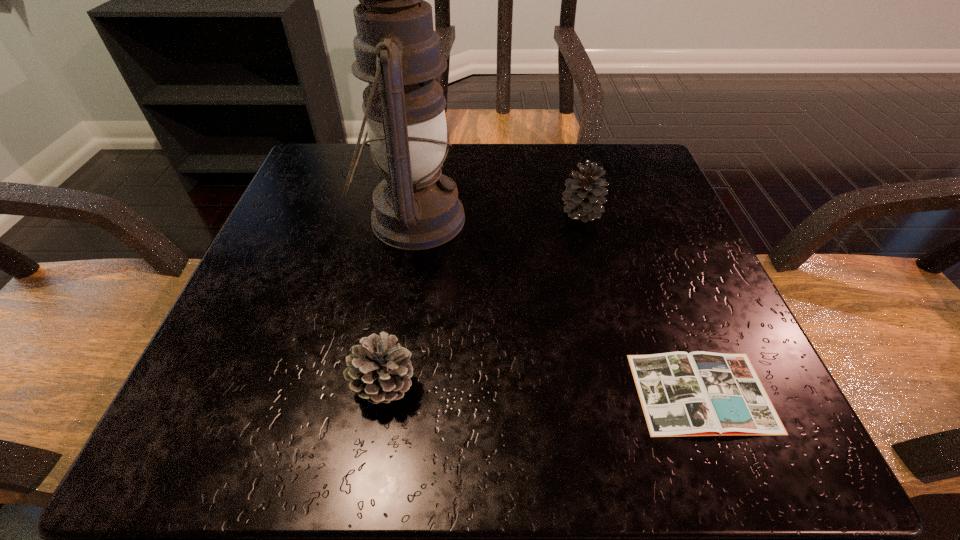
The width and height of the screenshot is (960, 540). In the image, there is a desktop. In order to click on vacant space at the far edge in this screenshot , I will do `click(505, 144)`.

Find the location of `free space at the near edge`. free space at the near edge is located at coordinates (402, 424).

Where is `vacant region at the left edge`? The height and width of the screenshot is (540, 960). vacant region at the left edge is located at coordinates (277, 227).

I want to click on vacant region at the right edge of the desktop, so click(x=646, y=270).

The height and width of the screenshot is (540, 960). Identify the location of free space at the near left corner of the desktop. (228, 408).

This screenshot has height=540, width=960. Identify the location of vacant point at the far right corner. (639, 152).

Locate an element on the screen. The height and width of the screenshot is (540, 960). vacant space at the near right corner is located at coordinates (721, 442).

Where is `unoccupied area between the right pinecone and the shortest object`? Image resolution: width=960 pixels, height=540 pixels. unoccupied area between the right pinecone and the shortest object is located at coordinates (641, 302).

Locate an element on the screen. Image resolution: width=960 pixels, height=540 pixels. blank region between the right pinecone and the shorter pinecone is located at coordinates (483, 299).

Where is `free space between the right pinecone and the shortest object`? Image resolution: width=960 pixels, height=540 pixels. free space between the right pinecone and the shortest object is located at coordinates (641, 302).